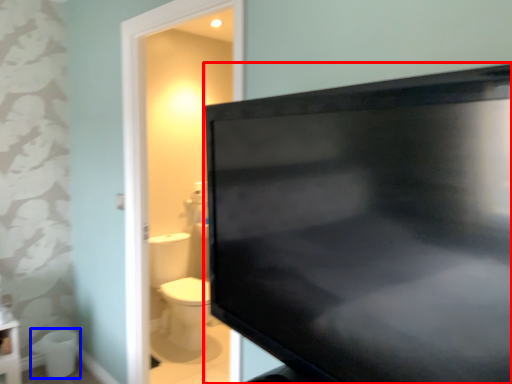
Question: Which object is closer to the camera taking this photo, television (highlighted by a red box) or toilet bowl (highlighted by a blue box)?

Choices:
 (A) television
 (B) toilet bowl

Answer: (A)